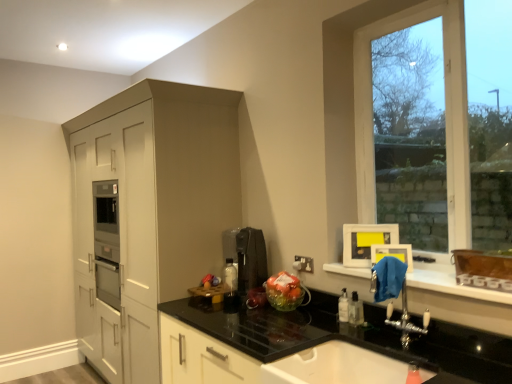
Question: Can you confirm if white glossy sink at lower center is shorter than matte white cabinet at left?

Choices:
 (A) yes
 (B) no

Answer: (A)

Question: Is white glossy sink at lower center wider than matte white cabinet at left?

Choices:
 (A) yes
 (B) no

Answer: (B)

Question: Can you confirm if white glossy sink at lower center is positioned to the left of matte white cabinet at left?

Choices:
 (A) yes
 (B) no

Answer: (B)

Question: Does white glossy sink at lower center have a greater height compared to matte white cabinet at left?

Choices:
 (A) no
 (B) yes

Answer: (A)

Question: Does white glossy sink at lower center touch matte white cabinet at left?

Choices:
 (A) no
 (B) yes

Answer: (A)

Question: Would you say matte white cabinet at left is part of white glossy sink at lower center's contents?

Choices:
 (A) yes
 (B) no

Answer: (B)

Question: From a real-world perspective, is clear glass window at upper right located higher than white glossy sink at lower center?

Choices:
 (A) no
 (B) yes

Answer: (B)

Question: Does clear glass window at upper right come behind white glossy sink at lower center?

Choices:
 (A) no
 (B) yes

Answer: (B)

Question: Is white glossy sink at lower center completely or partially inside clear glass window at upper right?

Choices:
 (A) yes
 (B) no

Answer: (B)

Question: Is clear glass window at upper right positioned in front of white glossy sink at lower center?

Choices:
 (A) no
 (B) yes

Answer: (A)

Question: Is clear glass window at upper right with white glossy sink at lower center?

Choices:
 (A) yes
 (B) no

Answer: (B)

Question: Is clear glass window at upper right completely or partially outside of white glossy sink at lower center?

Choices:
 (A) no
 (B) yes

Answer: (B)

Question: Is blue fabric at lower right inside clear plastic bottle at lower right?

Choices:
 (A) yes
 (B) no

Answer: (B)